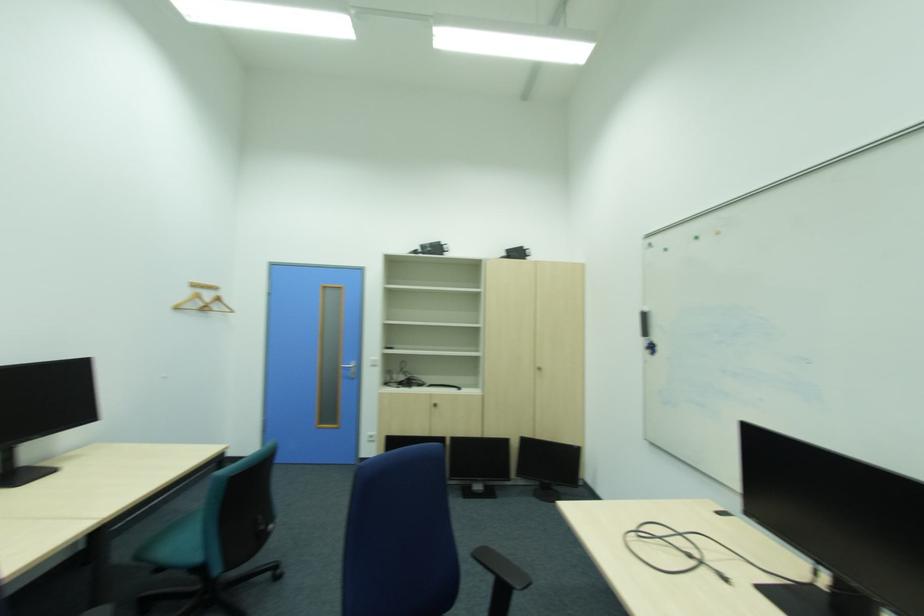
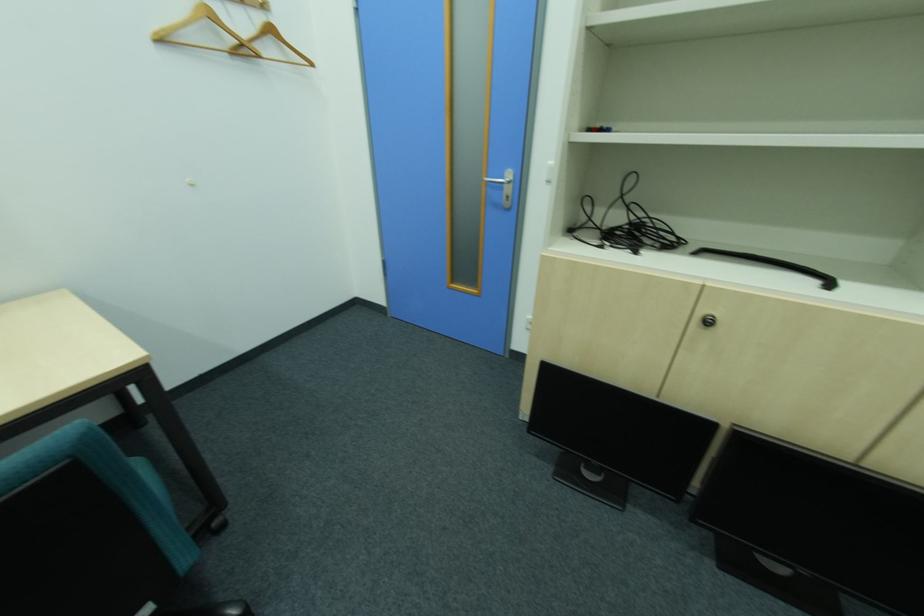
Locate, in the second image, the point that corresponds to point 214,307 in the first image.

(249, 45)